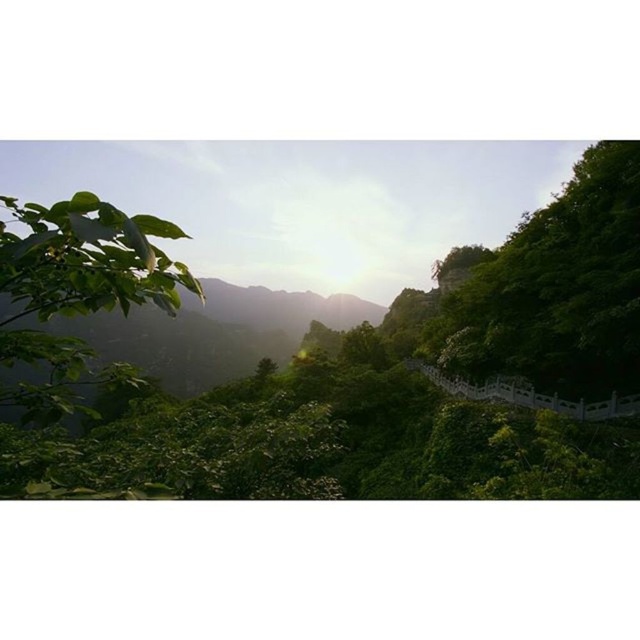
Is green leafy tree at right positioned before green leafy tree at left?

No, green leafy tree at right is behind green leafy tree at left.

Is green leafy tree at right below green leafy tree at left?

Incorrect, green leafy tree at right is not positioned below green leafy tree at left.

The image size is (640, 640). What do you see at coordinates (557, 289) in the screenshot?
I see `green leafy tree at right` at bounding box center [557, 289].

Find the location of a particular element. The image size is (640, 640). green leafy tree at right is located at coordinates (557, 289).